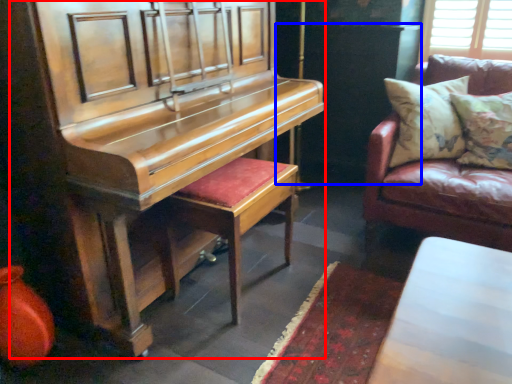
Question: Among these objects, which one is nearest to the camera, harpsichord (highlighted by a red box) or dark (highlighted by a blue box)?

Choices:
 (A) harpsichord
 (B) dark

Answer: (A)